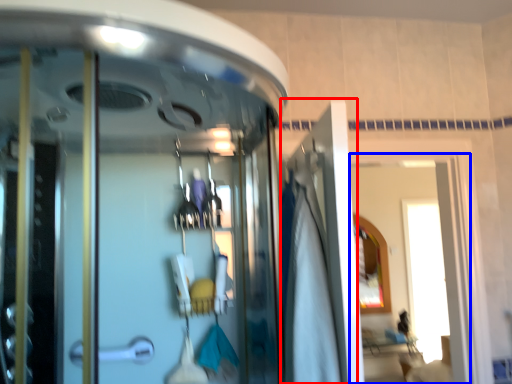
Question: Among these objects, which one is nearest to the camera, door (highlighted by a red box) or window (highlighted by a blue box)?

Choices:
 (A) door
 (B) window

Answer: (A)